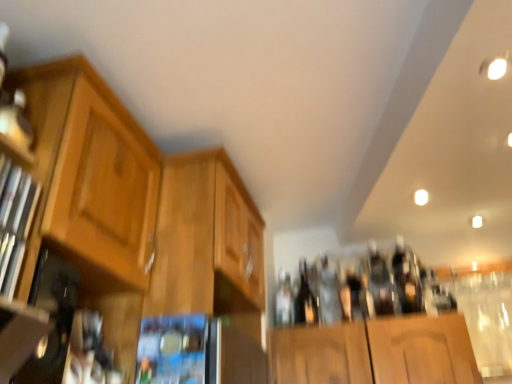
What do you see at coordinates (284, 301) in the screenshot? I see `clear glass bottle at center, which ranks as the 2th bottle in right-to-left order` at bounding box center [284, 301].

What do you see at coordinates (136, 213) in the screenshot?
I see `light brown wood cabinet at left, the 1th cabinetry positioned from the left` at bounding box center [136, 213].

What do you see at coordinates (344, 294) in the screenshot? I see `clear glass bottle at center, which is the first bottle from right to left` at bounding box center [344, 294].

What is the approximate height of metallic silver microwave at center?

It is 16.50 centimeters.

You are a GUI agent. You are given a task and a screenshot of the screen. Output one action in this format:
    pyautogui.click(x=<x>, y=<y>)
    Task: Click on the clear glass bottle at center, the 1th bottle when ordered from left to right
    
    Given the screenshot: What is the action you would take?
    pyautogui.click(x=284, y=301)

Do you think black glass beer bottle at center is within metallic silver microwave at center, or outside of it?

black glass beer bottle at center lies outside metallic silver microwave at center.

Who is shorter, black glass beer bottle at center or metallic silver microwave at center?

Standing shorter between the two is metallic silver microwave at center.

Between black glass beer bottle at center and metallic silver microwave at center, which one appears on the right side from the viewer's perspective?

From the viewer's perspective, black glass beer bottle at center appears more on the right side.

Can you tell me how much black glass beer bottle at center and metallic silver microwave at center differ in facing direction?

3.76 degrees.

Considering the sizes of clear glass bottle at center, which ranks as the 2th bottle in right-to-left order, and black glass beer bottle at center in the image, is clear glass bottle at center, which ranks as the 2th bottle in right-to-left order, wider or thinner than black glass beer bottle at center?

In the image, clear glass bottle at center, which ranks as the 2th bottle in right-to-left order, appears to be more narrow than black glass beer bottle at center.

Which is behind, point (292, 296) or point (311, 298)?

The point (292, 296) is farther.

From the image's perspective, is clear glass bottle at center, which ranks as the 2th bottle in right-to-left order, beneath black glass beer bottle at center?

Yes.

Is wooden cabinet at left to the right of clear glass bottle at center, the 1th bottle when ordered from left to right, from the viewer's perspective?

Incorrect, wooden cabinet at left is not on the right side of clear glass bottle at center, the 1th bottle when ordered from left to right.

Is wooden cabinet at left smaller than clear glass bottle at center, the 1th bottle when ordered from left to right?

No.

Considering the positions of points (10, 188) and (280, 303), is point (10, 188) farther from camera compared to point (280, 303)?

No, it is not.

Is clear glass bottle at center, which ranks as the 2th bottle in right-to-left order, touching light brown wood cabinet at left, the 1th cabinetry positioned from the left?

clear glass bottle at center, which ranks as the 2th bottle in right-to-left order, and light brown wood cabinet at left, the 1th cabinetry positioned from the left, are clearly separated.

Can you confirm if clear glass bottle at center, the 1th bottle when ordered from left to right, is positioned to the right of light brown wood cabinet at left, the 1th cabinetry positioned from the left?

Indeed, clear glass bottle at center, the 1th bottle when ordered from left to right, is positioned on the right side of light brown wood cabinet at left, the 1th cabinetry positioned from the left.

Based on their sizes in the image, would you say wooden cabinet at center, the first cabinetry positioned from the right, is bigger or smaller than wooden cabinet at left?

wooden cabinet at center, the first cabinetry positioned from the right, is bigger than wooden cabinet at left.

Is wooden cabinet at center, which ranks as the second cabinetry in left-to-right order, looking in the opposite direction of wooden cabinet at left?

wooden cabinet at center, which ranks as the second cabinetry in left-to-right order, is not turned away from wooden cabinet at left.

This screenshot has width=512, height=384. In order to click on shelf that is in front of the wooden cabinet at center, which ranks as the second cabinetry in left-to-right order in this screenshot , I will do `click(16, 225)`.

Consider the image. What's the angular difference between wooden cabinet at center, which ranks as the second cabinetry in left-to-right order, and wooden cabinet at left's facing directions?

1.92 degrees separate the facing orientations of wooden cabinet at center, which ranks as the second cabinetry in left-to-right order, and wooden cabinet at left.

Considering the sizes of light brown wood cabinet at left, which ranks as the second cabinetry in right-to-left order, and metallic silver microwave at center in the image, is light brown wood cabinet at left, which ranks as the second cabinetry in right-to-left order, wider or thinner than metallic silver microwave at center?

In the image, light brown wood cabinet at left, which ranks as the second cabinetry in right-to-left order, appears to be wider than metallic silver microwave at center.

From a real-world perspective, is light brown wood cabinet at left, the 1th cabinetry positioned from the left, below metallic silver microwave at center?

No, from a real-world perspective, light brown wood cabinet at left, the 1th cabinetry positioned from the left, is not under metallic silver microwave at center.

Does light brown wood cabinet at left, the 1th cabinetry positioned from the left, have a greater height compared to metallic silver microwave at center?

Correct, light brown wood cabinet at left, the 1th cabinetry positioned from the left, is much taller as metallic silver microwave at center.

Which is in front, point (79, 218) or point (168, 318)?

Point (79, 218)

Who is taller, wooden cabinet at center, which ranks as the second cabinetry in left-to-right order, or metallic silver microwave at center?

wooden cabinet at center, which ranks as the second cabinetry in left-to-right order.

Considering the sizes of objects wooden cabinet at center, which ranks as the second cabinetry in left-to-right order, and metallic silver microwave at center in the image provided, who is bigger, wooden cabinet at center, which ranks as the second cabinetry in left-to-right order, or metallic silver microwave at center?

wooden cabinet at center, which ranks as the second cabinetry in left-to-right order, is bigger.

Is wooden cabinet at center, which ranks as the second cabinetry in left-to-right order, not near metallic silver microwave at center?

wooden cabinet at center, which ranks as the second cabinetry in left-to-right order, is near metallic silver microwave at center, not far away.

Which object is positioned more to the left, wooden cabinet at center, the first cabinetry positioned from the right, or metallic silver microwave at center?

From the viewer's perspective, metallic silver microwave at center appears more on the left side.

You are a GUI agent. You are given a task and a screenshot of the screen. Output one action in this format:
    pyautogui.click(x=<x>, y=<y>)
    Task: Click on the appliance lying on the left of black glass beer bottle at center
    This screenshot has height=384, width=512.
    Given the screenshot: What is the action you would take?
    pyautogui.click(x=174, y=350)

Image resolution: width=512 pixels, height=384 pixels. What are the coordinates of `beer bottle that is above the clear glass bottle at center, the 1th bottle when ordered from left to right (from a real-world perspective)` in the screenshot? It's located at (305, 299).

Considering their positions, is wooden cabinet at center, the first cabinetry positioned from the right, positioned closer to wooden cabinet at left than clear glass bottle at center, the 1th bottle when ordered from left to right?

wooden cabinet at center, the first cabinetry positioned from the right, lies closer to wooden cabinet at left than the other object.

When comparing their distances from clear glass bottle at center, the second bottle in the left-to-right sequence, does wooden cabinet at center, which ranks as the second cabinetry in left-to-right order, or metallic silver microwave at center seem further?

metallic silver microwave at center lies further to clear glass bottle at center, the second bottle in the left-to-right sequence, than the other object.

Which object lies nearer to the anchor point black glass beer bottle at center, light brown wood cabinet at left, the 1th cabinetry positioned from the left, or wooden cabinet at left?

The object closer to black glass beer bottle at center is light brown wood cabinet at left, the 1th cabinetry positioned from the left.

Which object lies further to the anchor point metallic silver microwave at center, black glass beer bottle at center or light brown wood cabinet at left, the 1th cabinetry positioned from the left?

Among the two, black glass beer bottle at center is located further to metallic silver microwave at center.

From the image, which object appears to be nearer to black glass beer bottle at center, clear glass bottle at center, the 1th bottle when ordered from left to right, or metallic silver microwave at center?

clear glass bottle at center, the 1th bottle when ordered from left to right.

Based on their spatial positions, is black glass beer bottle at center or wooden cabinet at center, the first cabinetry positioned from the right, further from metallic silver microwave at center?

black glass beer bottle at center is further to metallic silver microwave at center.

Estimate the real-world distances between objects in this image. Which object is further from clear glass bottle at center, the 1th bottle when ordered from left to right, wooden cabinet at center, the first cabinetry positioned from the right, or clear glass bottle at center, the second bottle in the left-to-right sequence?

wooden cabinet at center, the first cabinetry positioned from the right, lies further to clear glass bottle at center, the 1th bottle when ordered from left to right, than the other object.

Considering their positions, is wooden cabinet at center, which ranks as the second cabinetry in left-to-right order, positioned further to wooden cabinet at left than black glass beer bottle at center?

Based on the image, black glass beer bottle at center appears to be further to wooden cabinet at left.

The image size is (512, 384). What are the coordinates of `cabinetry between light brown wood cabinet at left, which ranks as the second cabinetry in right-to-left order, and clear glass bottle at center, which ranks as the 2th bottle in right-to-left order, in the front-back direction` in the screenshot? It's located at (208, 244).

At what (x,y) coordinates should I click in order to perform the action: click on cabinetry between metallic silver microwave at center and black glass beer bottle at center in the front-back direction. Please return your answer as a coordinate pair (x, y). Looking at the image, I should click on (208, 244).

Identify the location of cabinetry between light brown wood cabinet at left, the 1th cabinetry positioned from the left, and clear glass bottle at center, which is the first bottle from right to left, in the front-back direction. The height and width of the screenshot is (384, 512). (208, 244).

Locate an element on the screen. bottle located between light brown wood cabinet at left, which ranks as the second cabinetry in right-to-left order, and clear glass bottle at center, the 1th bottle when ordered from left to right, in the depth direction is located at coordinates (344, 294).